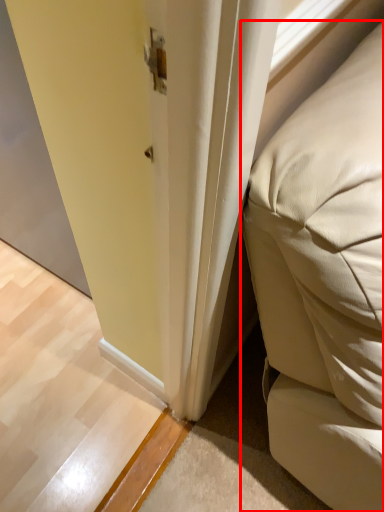
Question: From the image's perspective, where is furniture (annotated by the red box) located relative to screen door?

Choices:
 (A) below
 (B) above

Answer: (A)